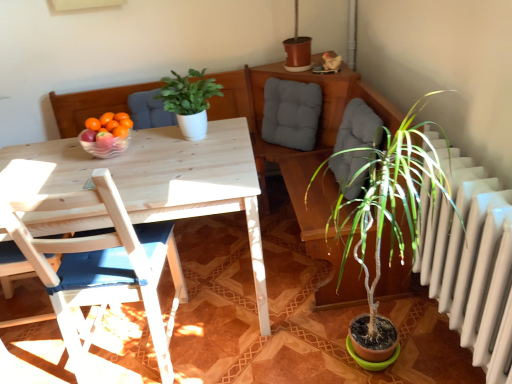
Question: From the image's perspective, is wooden chair with blue cushion at left above or below green matte plant at center?

Choices:
 (A) above
 (B) below

Answer: (B)

Question: Is point (88, 248) closer or farther from the camera than point (205, 104)?

Choices:
 (A) closer
 (B) farther

Answer: (A)

Question: Considering the real-world distances, which object is closest to the gray fabric cushion at upper center?

Choices:
 (A) transparent glass bowl at table
 (B) wooden chair with blue cushion at left
 (C) green matte plant at center

Answer: (C)

Question: Estimate the real-world distances between objects in this image. Which object is farther from the gray fabric cushion at upper center?

Choices:
 (A) wooden chair with blue cushion at left
 (B) transparent glass bowl at table
 (C) green matte plant at center

Answer: (A)